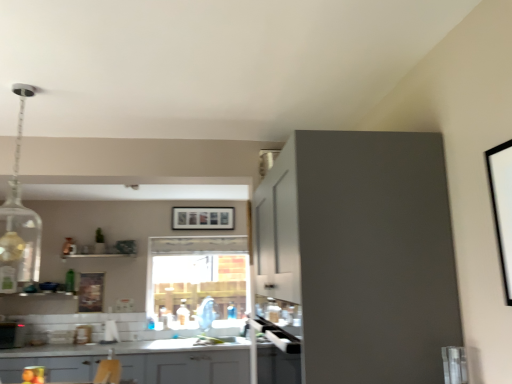
Measure the distance between metallic silver toaster at lower left and camera.

metallic silver toaster at lower left and camera are 4.28 meters apart.

Describe the element at coordinates (502, 207) in the screenshot. Image resolution: width=512 pixels, height=384 pixels. I see `white matte picture frame at upper right, placed as the third picture frame when sorted from back to front` at that location.

The width and height of the screenshot is (512, 384). Identify the location of clear glass window at center. (198, 282).

The image size is (512, 384). I want to click on matte gray cabinet at upper right, arranged as the second cabinetry when viewed from the left, so click(x=361, y=254).

How much space does matte gray cabinet at upper right, arranged as the second cabinetry when viewed from the left, occupy horizontally?

matte gray cabinet at upper right, arranged as the second cabinetry when viewed from the left, is 63.35 centimeters in width.

What is the approximate height of matte gray cabinets at lower center, positioned as the 1th cabinetry in left-to-right order?

matte gray cabinets at lower center, positioned as the 1th cabinetry in left-to-right order, is 21.28 inches tall.

I want to click on matte gray cabinets at lower center, positioned as the 1th cabinetry in left-to-right order, so click(x=188, y=367).

The height and width of the screenshot is (384, 512). Find the location of `wooden picture frame at lower left, the 2th picture frame viewed from the front`. wooden picture frame at lower left, the 2th picture frame viewed from the front is located at coordinates (90, 292).

From a real-world perspective, which object rests below the other?

From a 3D spatial view, wooden picture frame at lower left, marked as the 3th picture frame in a top-to-bottom arrangement, is below.

From the image's perspective, between clear glass window at center and wooden picture frame at lower left, marked as the 3th picture frame in a top-to-bottom arrangement, which one is located above?

From the image's view, clear glass window at center is above.

Is clear glass window at center facing towards wooden picture frame at lower left, the first picture frame from the left?

No, clear glass window at center does not turn towards wooden picture frame at lower left, the first picture frame from the left.

Can you tell me how much clear glass window at center and wooden picture frame at lower left, the first picture frame from the left, differ in facing direction?

There is a 1-degree angle between the facing directions of clear glass window at center and wooden picture frame at lower left, the first picture frame from the left.

Considering the relative sizes of white matte picture frame at upper right, the 1th picture frame from the top, and matte gray cabinets at lower center, which ranks as the 2th cabinetry in top-to-bottom order, in the image provided, is white matte picture frame at upper right, the 1th picture frame from the top, thinner than matte gray cabinets at lower center, which ranks as the 2th cabinetry in top-to-bottom order,?

Yes, white matte picture frame at upper right, the 1th picture frame from the top, is thinner than matte gray cabinets at lower center, which ranks as the 2th cabinetry in top-to-bottom order.

Considering the relative sizes of white matte picture frame at upper right, placed as the third picture frame when sorted from back to front, and matte gray cabinets at lower center, positioned as the 1th cabinetry in left-to-right order, in the image provided, is white matte picture frame at upper right, placed as the third picture frame when sorted from back to front, bigger than matte gray cabinets at lower center, positioned as the 1th cabinetry in left-to-right order,?

Actually, white matte picture frame at upper right, placed as the third picture frame when sorted from back to front, might be smaller than matte gray cabinets at lower center, positioned as the 1th cabinetry in left-to-right order.

Can you tell me how much white matte picture frame at upper right, which ranks as the third picture frame in left-to-right order, and matte gray cabinets at lower center, the second cabinetry positioned from the front, differ in facing direction?

There is a 90.1-degree angle between the facing directions of white matte picture frame at upper right, which ranks as the third picture frame in left-to-right order, and matte gray cabinets at lower center, the second cabinetry positioned from the front.

From the matte gray cabinets at lower center, positioned as the 1th cabinetry in back-to-front order, count 2nd picture frame to the right and point to it. Please provide its 2D coordinates.

[(502, 207)]

Does point (97, 310) lie behind point (72, 281)?

No, it is not.

Which of these two, wooden picture frame at lower left, marked as the 3th picture frame in a top-to-bottom arrangement, or green glass bottle at lower left, is bigger?

Bigger between the two is wooden picture frame at lower left, marked as the 3th picture frame in a top-to-bottom arrangement.

You are a GUI agent. You are given a task and a screenshot of the screen. Output one action in this format:
    pyautogui.click(x=<x>, y=<y>)
    Task: Click on the 1st picture frame in front of the green glass bottle at lower left
    Image resolution: width=512 pixels, height=384 pixels.
    Given the screenshot: What is the action you would take?
    pyautogui.click(x=90, y=292)

Is wooden picture frame at lower left, placed as the third picture frame when sorted from right to left, looking in the opposite direction of matte black picture frame at center, positioned as the second picture frame in right-to-left order?

No, wooden picture frame at lower left, placed as the third picture frame when sorted from right to left,'s orientation is not away from matte black picture frame at center, positioned as the second picture frame in right-to-left order.

Is wooden picture frame at lower left, placed as the third picture frame when sorted from right to left, taller than matte black picture frame at center, the 2th picture frame from the bottom?

Yes.

Would you consider wooden picture frame at lower left, placed as the third picture frame when sorted from right to left, to be distant from matte black picture frame at center, the 2th picture frame from the bottom?

That's right, there is a large distance between wooden picture frame at lower left, placed as the third picture frame when sorted from right to left, and matte black picture frame at center, the 2th picture frame from the bottom.

Is point (84, 305) closer to viewer compared to point (229, 214)?

Yes.

Is matte gray cabinet at upper right, arranged as the second cabinetry when viewed from the left, inside the boundaries of metallic silver toaster at lower left, or outside?

matte gray cabinet at upper right, arranged as the second cabinetry when viewed from the left, exists outside the volume of metallic silver toaster at lower left.

Considering the relative positions of matte gray cabinet at upper right, the 1th cabinetry in the right-to-left sequence, and metallic silver toaster at lower left in the image provided, is matte gray cabinet at upper right, the 1th cabinetry in the right-to-left sequence, in front of metallic silver toaster at lower left?

Yes.

From the image's perspective, which is above, matte gray cabinet at upper right, acting as the second cabinetry starting from the back, or metallic silver toaster at lower left?

matte gray cabinet at upper right, acting as the second cabinetry starting from the back, is shown above in the image.

Considering the points (406, 272) and (7, 337), which point is in front, point (406, 272) or point (7, 337)?

The point (406, 272) is closer to the camera.

Is matte gray cabinet at upper right, which is the 1th cabinetry from front to back, in contact with white glossy sink at center?

No, matte gray cabinet at upper right, which is the 1th cabinetry from front to back, is not making contact with white glossy sink at center.

How much distance is there between matte gray cabinet at upper right, arranged as the second cabinetry when viewed from the left, and white glossy sink at center?

They are 3.11 meters apart.

Is white glossy sink at center surrounded by matte gray cabinet at upper right, acting as the second cabinetry starting from the back?

No, white glossy sink at center is not surrounded by matte gray cabinet at upper right, acting as the second cabinetry starting from the back.

Is matte gray cabinet at upper right, which is the 1th cabinetry from front to back, in front of or behind white glossy sink at center in the image?

Visually, matte gray cabinet at upper right, which is the 1th cabinetry from front to back, is located in front of white glossy sink at center.

Considering the sizes of objects green glass bottle at lower left and white glossy sink at center in the image provided, who is smaller, green glass bottle at lower left or white glossy sink at center?

green glass bottle at lower left is smaller.

In the scene shown: In the image, is green glass bottle at lower left positioned in front of or behind white glossy sink at center?

In the image, green glass bottle at lower left appears behind white glossy sink at center.

Locate an element on the screen. bottle located on the left of white glossy sink at center is located at coordinates (70, 281).

Image resolution: width=512 pixels, height=384 pixels. What are the coordinates of `picture frame on the left of clear glass window at center` in the screenshot? It's located at (90, 292).

At what (x,y) coordinates should I click in order to perform the action: click on picture frame that appears in front of the matte gray cabinets at lower center, which ranks as the 2th cabinetry in top-to-bottom order. Please return your answer as a coordinate pair (x, y). The height and width of the screenshot is (384, 512). Looking at the image, I should click on (502, 207).

Which object lies nearer to the anchor point matte gray cabinet at upper right, which is the 1th cabinetry from front to back, matte black picture frame at center, which appears as the 2th picture frame when viewed from the left, or matte gray cabinets at lower center, which is the 1th cabinetry in bottom-to-top order?

Based on the image, matte gray cabinets at lower center, which is the 1th cabinetry in bottom-to-top order, appears to be nearer to matte gray cabinet at upper right, which is the 1th cabinetry from front to back.

When comparing their distances from metallic silver toaster at lower left, does wooden picture frame at lower left, placed as the third picture frame when sorted from right to left, or white glossy sink at center seem closer?

The object closer to metallic silver toaster at lower left is wooden picture frame at lower left, placed as the third picture frame when sorted from right to left.

Looking at the image, which one is located closer to green glass bottle at lower left, matte black picture frame at center, which ranks as the second picture frame in top-to-bottom order, or matte gray cabinet at upper right, the first cabinetry in the top-to-bottom sequence?

The object closer to green glass bottle at lower left is matte black picture frame at center, which ranks as the second picture frame in top-to-bottom order.

From the image, which object appears to be farther from matte black picture frame at center, which ranks as the second picture frame in top-to-bottom order, white matte picture frame at upper right, placed as the third picture frame when sorted from back to front, or metallic silver toaster at lower left?

white matte picture frame at upper right, placed as the third picture frame when sorted from back to front, lies further to matte black picture frame at center, which ranks as the second picture frame in top-to-bottom order, than the other object.

Which object lies further to the anchor point metallic silver toaster at lower left, white matte picture frame at upper right, placed as the third picture frame when sorted from back to front, or green glass bottle at lower left?

Based on the image, white matte picture frame at upper right, placed as the third picture frame when sorted from back to front, appears to be further to metallic silver toaster at lower left.

From the image, which object appears to be nearer to green glass bottle at lower left, metallic silver toaster at lower left or matte gray cabinet at upper right, arranged as the second cabinetry when viewed from the left?

Based on the image, metallic silver toaster at lower left appears to be nearer to green glass bottle at lower left.

From the image, which object appears to be farther from wooden picture frame at lower left, arranged as the 2th picture frame when viewed from the back, matte black picture frame at center, marked as the 3th picture frame in a front-to-back arrangement, or matte gray cabinet at upper right, the 1th cabinetry in the right-to-left sequence?

Among the two, matte gray cabinet at upper right, the 1th cabinetry in the right-to-left sequence, is located further to wooden picture frame at lower left, arranged as the 2th picture frame when viewed from the back.

Looking at the image, which one is located further to matte black picture frame at center, the first picture frame from the back, white matte picture frame at upper right, placed as the third picture frame when sorted from back to front, or matte gray cabinet at upper right, which is the second cabinetry from bottom to top?

white matte picture frame at upper right, placed as the third picture frame when sorted from back to front, is positioned further to the anchor matte black picture frame at center, the first picture frame from the back.

The width and height of the screenshot is (512, 384). In order to click on picture frame between green glass bottle at lower left and matte black picture frame at center, the first picture frame from the back, from left to right in this screenshot , I will do `click(90, 292)`.

This screenshot has height=384, width=512. Find the location of `window between green glass bottle at lower left and matte black picture frame at center, the 2th picture frame from the bottom, in the horizontal direction`. window between green glass bottle at lower left and matte black picture frame at center, the 2th picture frame from the bottom, in the horizontal direction is located at coordinates (198, 282).

Where is `appliance between matte gray cabinet at upper right, which is the second cabinetry from bottom to top, and wooden picture frame at lower left, arranged as the 2th picture frame when viewed from the back, in the front-back direction`? This screenshot has height=384, width=512. appliance between matte gray cabinet at upper right, which is the second cabinetry from bottom to top, and wooden picture frame at lower left, arranged as the 2th picture frame when viewed from the back, in the front-back direction is located at coordinates [x=12, y=335].

The image size is (512, 384). What are the coordinates of `bottle positioned between matte gray cabinet at upper right, acting as the second cabinetry starting from the back, and matte black picture frame at center, which ranks as the second picture frame in top-to-bottom order, from near to far` in the screenshot? It's located at (70, 281).